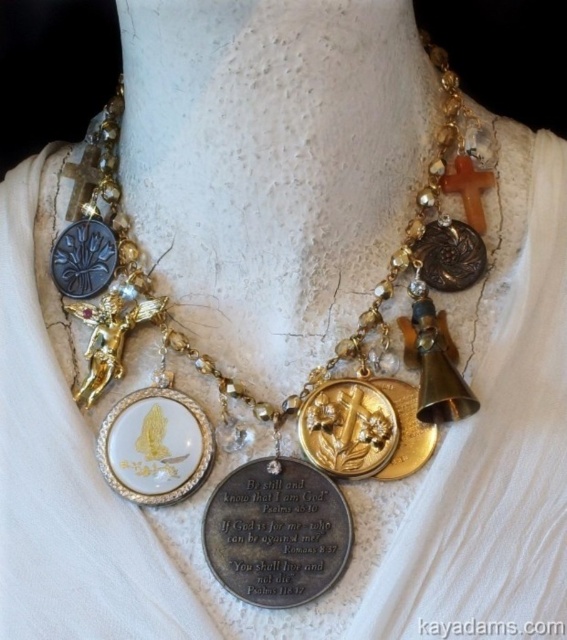
You are an appraiser examining the necklace from the image. You need to determine the order of the medallions. Which medallion is placed above the other between the gold metallic medallions at center and the gold textured medallion at center?

The gold metallic medallions at center is positioned over the gold textured medallion at center, meaning it is placed above the other.

You are an appraiser examining the necklace. The gold textured medallion at center is crucial for authentication. Where exactly is it positioned on the necklace?

The gold textured medallion at center is positioned at the coordinates point (450, 256) on the necklace.